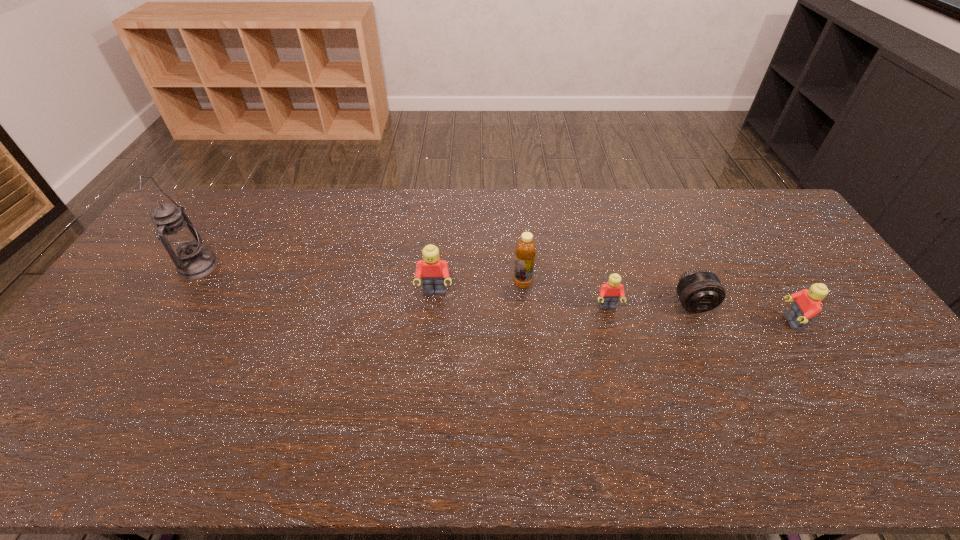
Please show where to add a Lego on the left while keeping spacing even. Please provide its 2D coordinates. Your answer should be formatted as a tuple, i.e. [(x, y)], where the tuple contains the x and y coordinates of a point satisfying the conditions above.

[(272, 279)]